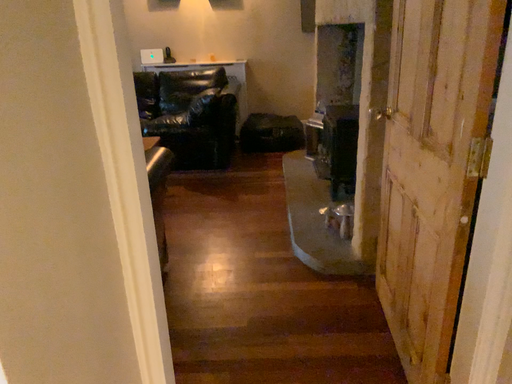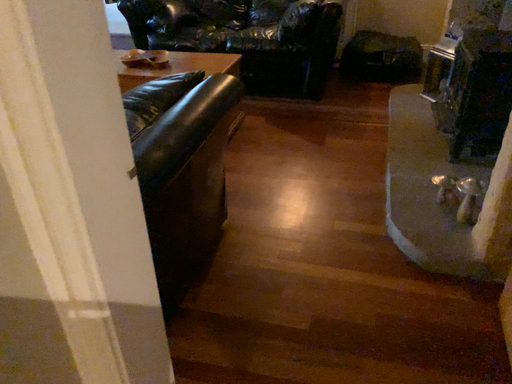
Question: How did the camera likely rotate when shooting the video?

Choices:
 (A) rotated right
 (B) rotated left

Answer: (B)